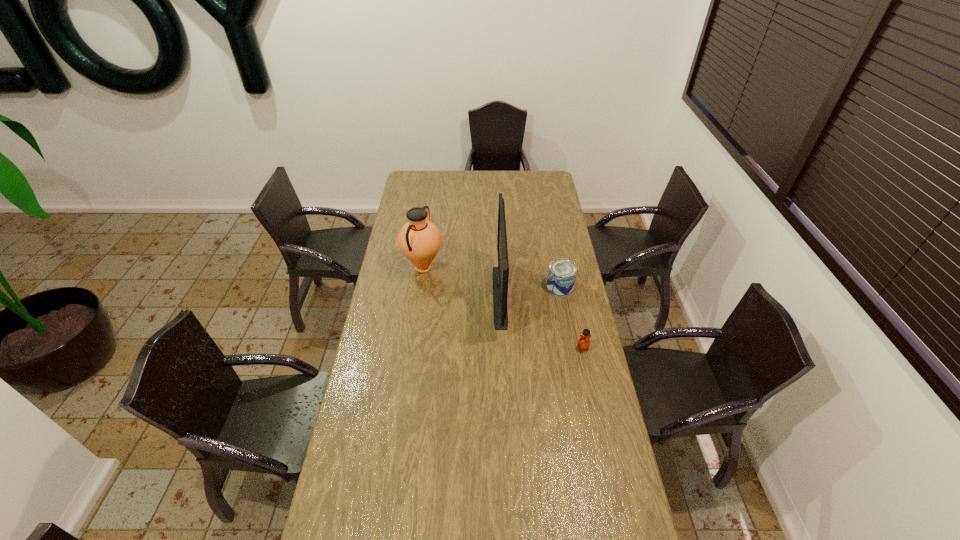
Find the location of a particular element. The height and width of the screenshot is (540, 960). empty location between the shortest object and the can is located at coordinates (571, 318).

Image resolution: width=960 pixels, height=540 pixels. I want to click on empty location between the third object from right to left and the second shortest object, so click(530, 292).

The width and height of the screenshot is (960, 540). Identify the location of blank region between the second object from left to right and the pitcher. (462, 282).

Locate an element on the screen. The image size is (960, 540). free space that is in between the third object from right to left and the leftmost object is located at coordinates (462, 282).

Find the location of a particular element. vacant area that lies between the monitor and the can is located at coordinates (530, 292).

Identify which object is the closest to the leftmost object. Please provide its 2D coordinates. Your answer should be formatted as a tuple, i.e. [(x, y)], where the tuple contains the x and y coordinates of a point satisfying the conditions above.

[(500, 275)]

The height and width of the screenshot is (540, 960). I want to click on the second closest object to the second shortest object, so click(x=583, y=344).

Identify the location of free space that satisfies the following two spatial constraints: 1. on the front label of the can; 2. on the front-facing side of the third object from right to left. The height and width of the screenshot is (540, 960). (562, 296).

Image resolution: width=960 pixels, height=540 pixels. I want to click on free spot that satisfies the following two spatial constraints: 1. on the front label of the third tallest object; 2. on the front-facing side of the tallest object, so click(562, 296).

This screenshot has height=540, width=960. What are the coordinates of `vacant space that satisfies the following two spatial constraints: 1. on the front label of the can; 2. on the front-facing side of the third object from right to left` in the screenshot? It's located at click(x=562, y=296).